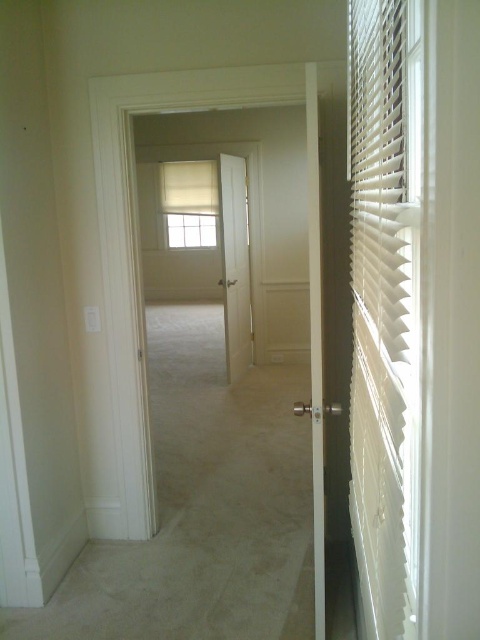
Is white smooth door at center bigger than white matte window at center?

Incorrect, white smooth door at center is not larger than white matte window at center.

Does white smooth door at center have a smaller size compared to white matte window at center?

Indeed, white smooth door at center has a smaller size compared to white matte window at center.

Locate an element on the screen. The width and height of the screenshot is (480, 640). white smooth door at center is located at coordinates (235, 262).

Looking at this image, can you confirm if white plastic blinds at right is positioned above white smooth door at center?

Actually, white plastic blinds at right is below white smooth door at center.

Is white plastic blinds at right thinner than white smooth door at center?

Correct, white plastic blinds at right's width is less than white smooth door at center's.

Which is in front, point (369, 506) or point (233, 232)?

Point (369, 506) is in front.

Image resolution: width=480 pixels, height=640 pixels. Identify the location of white plastic blinds at right. (385, 305).

Identify the location of white plastic blinds at right. (385, 305).

Between point (359, 35) and point (192, 200), which one is positioned in front?

Positioned in front is point (359, 35).

Identify the location of white plastic blinds at right. (385, 305).